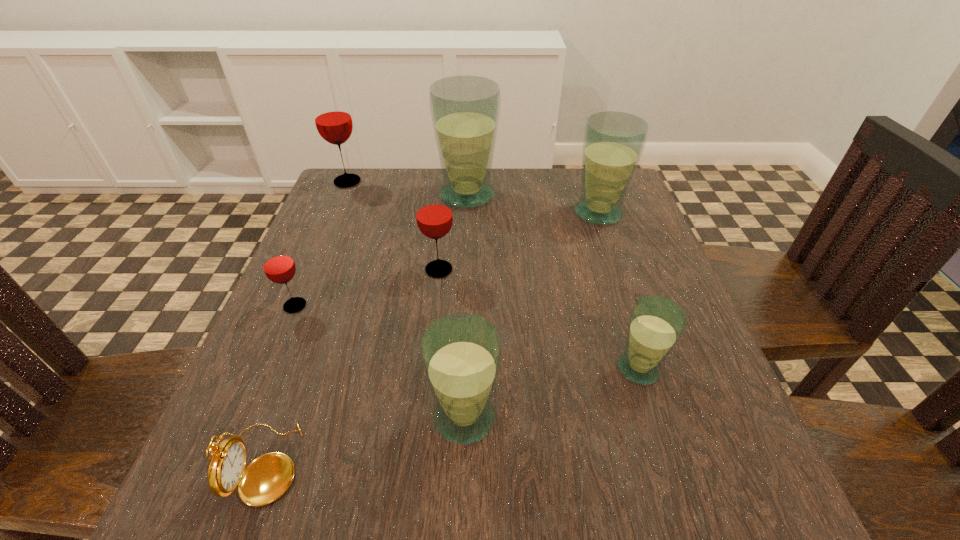
Identify the location of pocket watch that is at the left edge. This screenshot has width=960, height=540. 265,479.

The width and height of the screenshot is (960, 540). What are the coordinates of `object present at the far left corner` in the screenshot? It's located at (332, 116).

At what (x,y) coordinates should I click in order to perform the action: click on object at the near left corner. Please return your answer as a coordinate pair (x, y). Looking at the image, I should click on (265, 479).

The height and width of the screenshot is (540, 960). Find the location of `object at the far right corner`. object at the far right corner is located at coordinates coord(613,142).

Identify the location of free space at the far edge. (496, 208).

Where is `vacant space at the near edge of the desktop`? This screenshot has width=960, height=540. vacant space at the near edge of the desktop is located at coordinates (636, 511).

Locate an element on the screen. This screenshot has height=540, width=960. free space at the left edge of the desktop is located at coordinates (326, 272).

The height and width of the screenshot is (540, 960). What are the coordinates of `vacant space at the right edge of the desktop` in the screenshot? It's located at (587, 241).

You are a GUI agent. You are given a task and a screenshot of the screen. Output one action in this format:
    pyautogui.click(x=<x>, y=<y>)
    Task: Click on the free location at the far left corner
    
    Given the screenshot: What is the action you would take?
    pyautogui.click(x=381, y=216)

The width and height of the screenshot is (960, 540). In order to click on free space at the near left corner of the desktop in this screenshot , I will do `click(204, 460)`.